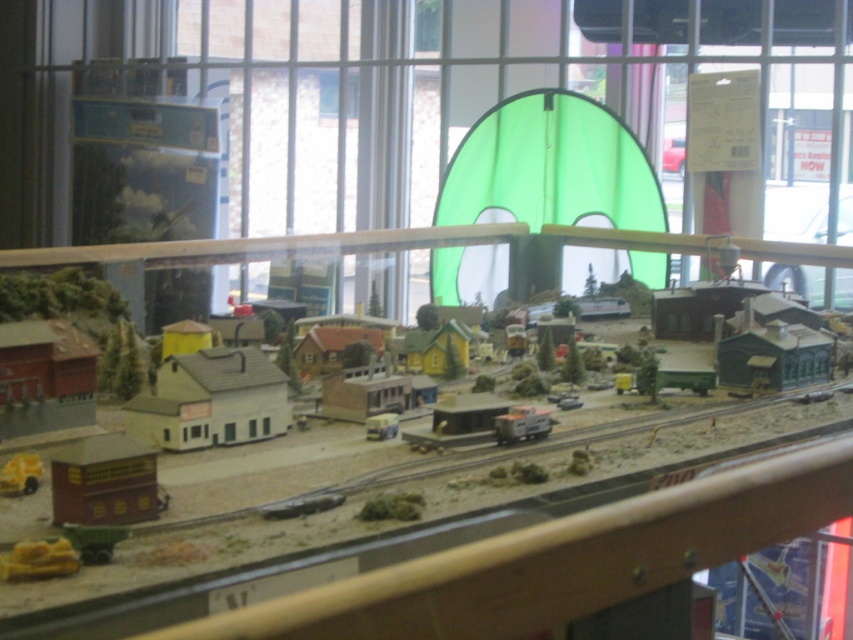
You are a curator planning to add a new miniature building to the model train set. You have a building that is 10 cm wide. The metallic silver trailer at center and the metallic silver train car at center are currently occupying space along the railway track. Can the new building fit between them if placed there?

The metallic silver trailer at center is wider than the metallic silver train car at center. Since the trailer is wider, the space between them may not be sufficient for a 10 cm wide building. You should check the exact measurements to ensure there is enough space.

You are a visitor at the model train exhibition. You notice the metallic silver trailer at center and the metallic silver train car at center. Which one is closer to the front of the display?

The metallic silver trailer at center is in front of the metallic silver train car at center, so it is closer to the front of the display.